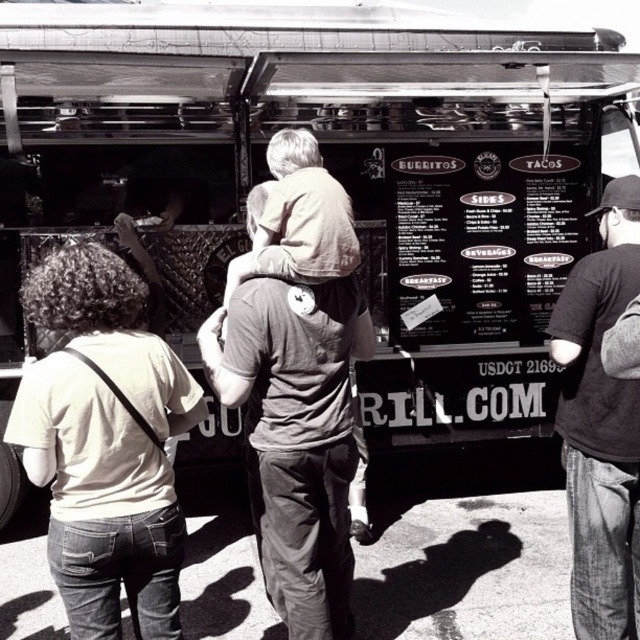
Is black matte menu board at center further to the viewer compared to dark gray t-shirt at right?

Yes, black matte menu board at center is further from the viewer.

Which is above, black matte menu board at center or dark gray t-shirt at right?

black matte menu board at center is above.

You are a GUI agent. You are given a task and a screenshot of the screen. Output one action in this format:
    pyautogui.click(x=<x>, y=<y>)
    Task: Click on the black matte menu board at center
    
    Given the screenshot: What is the action you would take?
    pyautogui.click(x=481, y=237)

Locate an element on the screen. The height and width of the screenshot is (640, 640). black matte menu board at center is located at coordinates (481, 237).